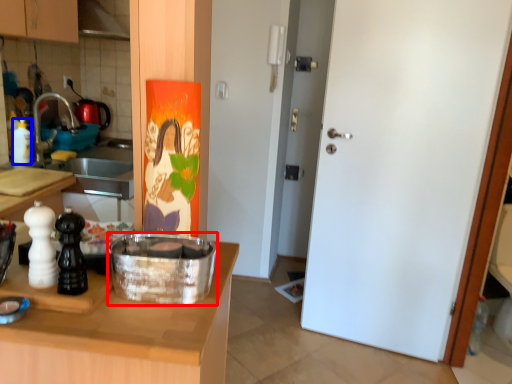
Question: Among these objects, which one is farthest to the camera, kitchen appliance (highlighted by a red box) or bottle (highlighted by a blue box)?

Choices:
 (A) kitchen appliance
 (B) bottle

Answer: (B)